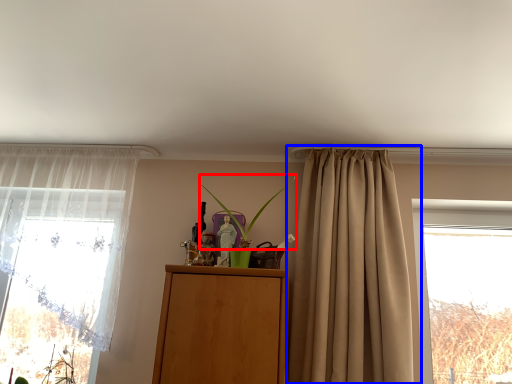
Question: Which object appears closest to the camera in this image, plant (highlighted by a red box) or curtain (highlighted by a blue box)?

Choices:
 (A) plant
 (B) curtain

Answer: (B)